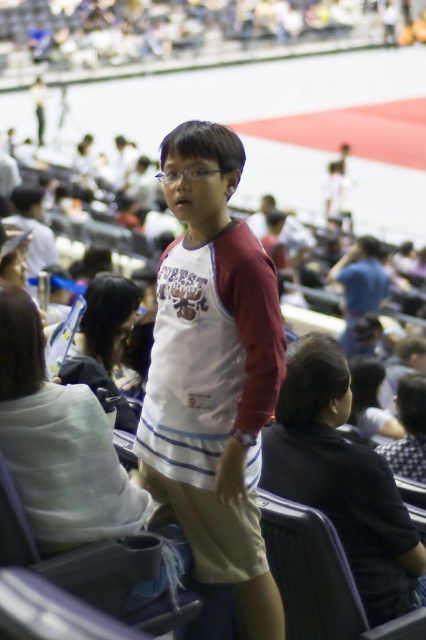
Question: Which point is closer to the camera taking this photo?

Choices:
 (A) (403, 438)
 (B) (175, 388)
 (C) (287, 451)

Answer: (B)

Question: Can you confirm if white cotton shirt at center is wider than black fabric shirt at center?

Choices:
 (A) yes
 (B) no

Answer: (B)

Question: Which object is farther from the camera taking this photo?

Choices:
 (A) white cotton shirt at center
 (B) checkered fabric headscarf at center
 (C) black fabric shirt at center

Answer: (B)

Question: Is black fabric shirt at center bigger than checkered fabric headscarf at center?

Choices:
 (A) no
 (B) yes

Answer: (B)

Question: Estimate the real-world distances between objects in this image. Which object is closer to the checkered fabric headscarf at center?

Choices:
 (A) black fabric shirt at center
 (B) white cotton shirt at center

Answer: (A)

Question: Is white cotton shirt at center to the left of checkered fabric headscarf at center from the viewer's perspective?

Choices:
 (A) no
 (B) yes

Answer: (B)